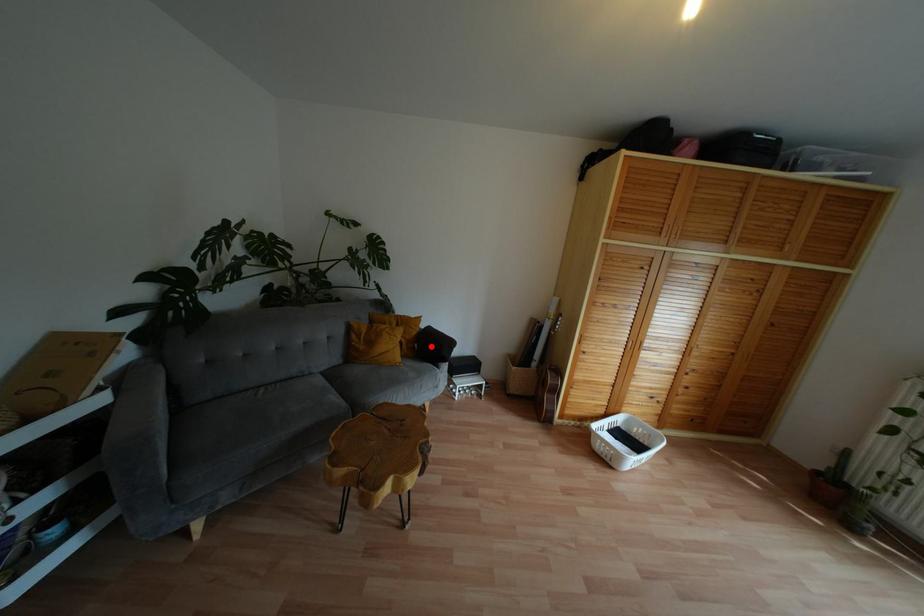
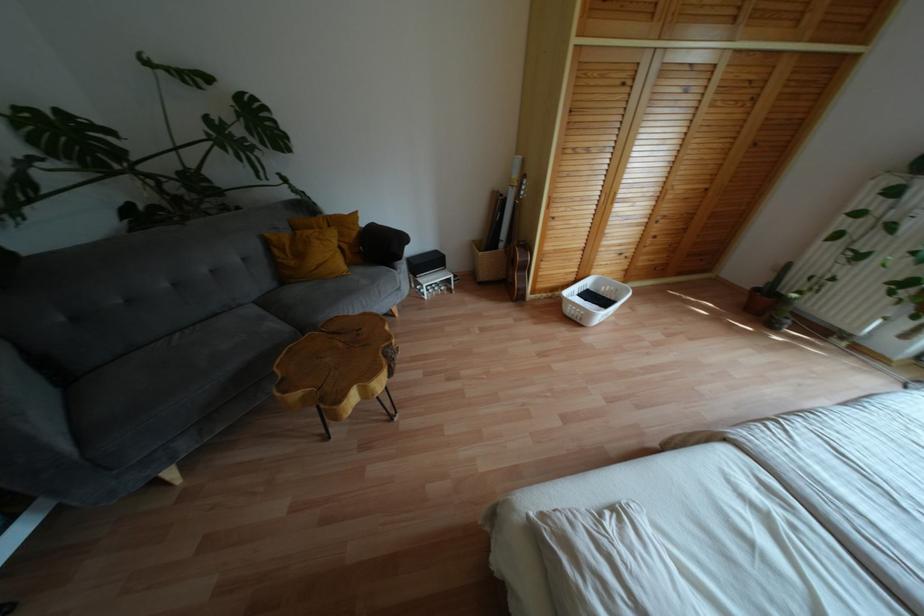
Question: I am providing you with two images of the same scene from different viewpoints. A red point is marked on the first image. Can you still see the location of the red point in image 2?

Choices:
 (A) Yes
 (B) No

Answer: (A)